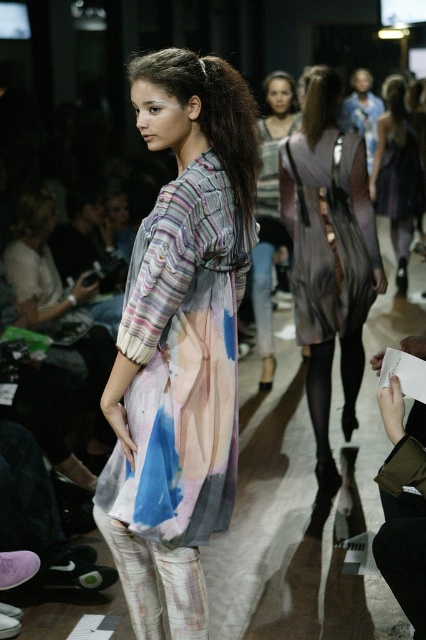
Question: Is striped fabric dress at center closer to the viewer compared to matte purple dress at center?

Choices:
 (A) no
 (B) yes

Answer: (B)

Question: Considering the real-world distances, which object is closest to the matte purple dress at center?

Choices:
 (A) striped fabric dress at center
 (B) silky purple dress at center

Answer: (A)

Question: Which is nearer to the silky purple dress at center?

Choices:
 (A) translucent tie-dye dress at center
 (B) matte purple dress at center
 (C) striped fabric dress at center

Answer: (C)

Question: Which point is farther to the camera?

Choices:
 (A) matte purple dress at center
 (B) striped fabric dress at center

Answer: (A)

Question: Considering the relative positions of silky purple dress at center and striped fabric dress at center in the image provided, where is silky purple dress at center located with respect to striped fabric dress at center?

Choices:
 (A) left
 (B) right

Answer: (B)

Question: Can you confirm if translucent tie-dye dress at center is positioned below silky purple dress at center?

Choices:
 (A) yes
 (B) no

Answer: (A)